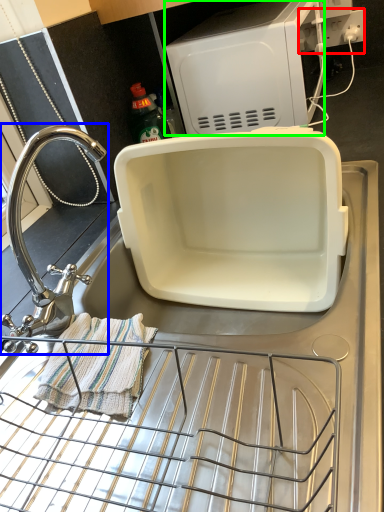
Question: Estimate the real-world distances between objects in this image. Which object is farther from electric outlet (highlighted by a red box), tap (highlighted by a blue box) or appliance (highlighted by a green box)?

Choices:
 (A) tap
 (B) appliance

Answer: (A)